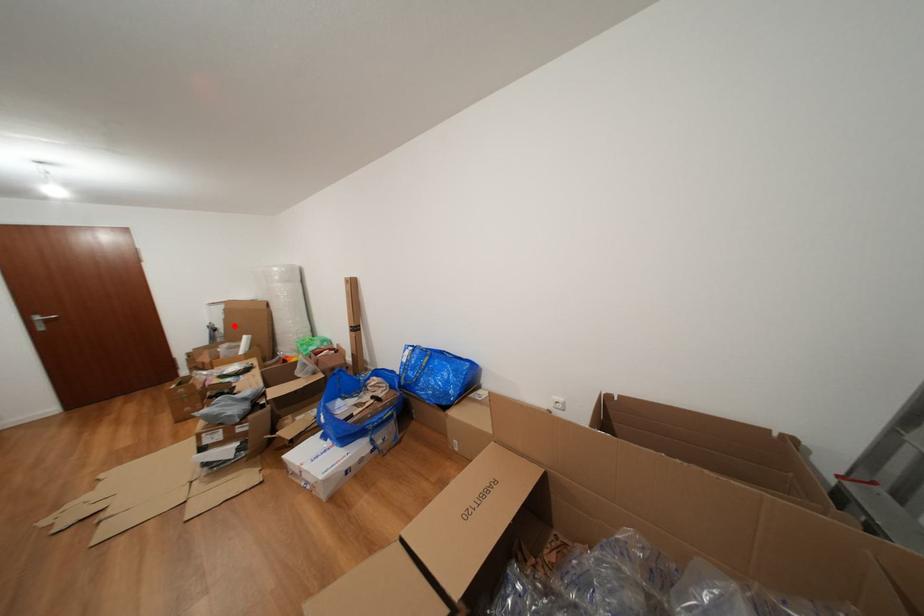
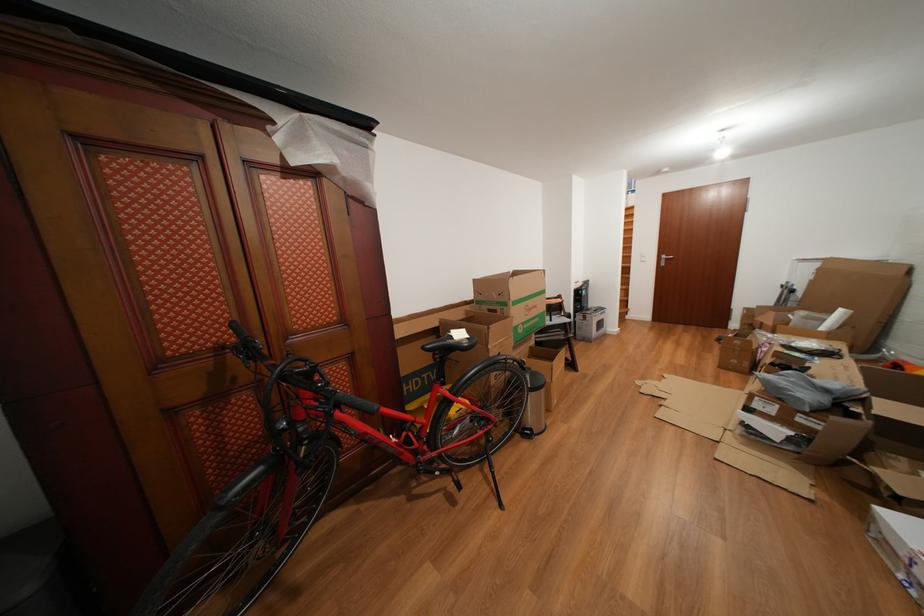
The point at the highlighted location is marked in the first image. Where is the corresponding point in the second image?

(821, 288)